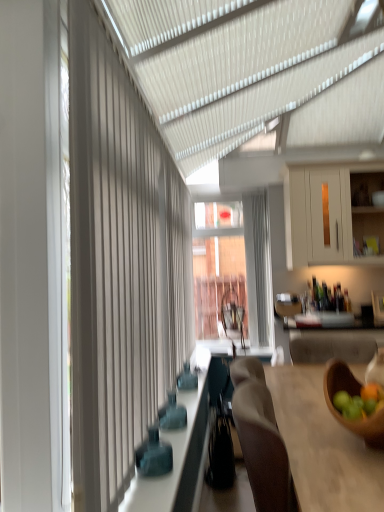
Question: From the image's perspective, is white matte cabinet at upper right over matte blue glass bottles at center?

Choices:
 (A) no
 (B) yes

Answer: (B)

Question: From a real-world perspective, is white matte cabinet at upper right positioned over matte blue glass bottles at center based on gravity?

Choices:
 (A) no
 (B) yes

Answer: (B)

Question: Considering the relative sizes of white matte cabinet at upper right and matte blue glass bottles at center in the image provided, is white matte cabinet at upper right thinner than matte blue glass bottles at center?

Choices:
 (A) no
 (B) yes

Answer: (A)

Question: Is white matte cabinet at upper right at the right side of matte blue glass bottles at center?

Choices:
 (A) yes
 (B) no

Answer: (A)

Question: Does white matte cabinet at upper right contain matte blue glass bottles at center?

Choices:
 (A) no
 (B) yes

Answer: (A)

Question: Is white textured curtain at left inside or outside of wooden table at right?

Choices:
 (A) outside
 (B) inside

Answer: (A)

Question: In the image, is white textured curtain at left on the left side or the right side of wooden table at right?

Choices:
 (A) left
 (B) right

Answer: (A)

Question: Is white textured curtain at left wider or thinner than wooden table at right?

Choices:
 (A) thin
 (B) wide

Answer: (A)

Question: Looking at the image, does white textured curtain at left seem bigger or smaller compared to wooden table at right?

Choices:
 (A) big
 (B) small

Answer: (B)

Question: From the image's perspective, is wooden table at right positioned above or below wooden bowl at lower right?

Choices:
 (A) below
 (B) above

Answer: (A)

Question: From a real-world perspective, is wooden table at right physically located above or below wooden bowl at lower right?

Choices:
 (A) below
 (B) above

Answer: (A)

Question: Considering their positions, is wooden table at right located in front of or behind wooden bowl at lower right?

Choices:
 (A) front
 (B) behind

Answer: (A)

Question: Is wooden table at right bigger or smaller than wooden bowl at lower right?

Choices:
 (A) big
 (B) small

Answer: (A)

Question: Based on their sizes in the image, would you say wooden table at right is bigger or smaller than matte blue glass bottles at center?

Choices:
 (A) small
 (B) big

Answer: (B)

Question: In terms of height, does wooden table at right look taller or shorter compared to matte blue glass bottles at center?

Choices:
 (A) short
 (B) tall

Answer: (B)